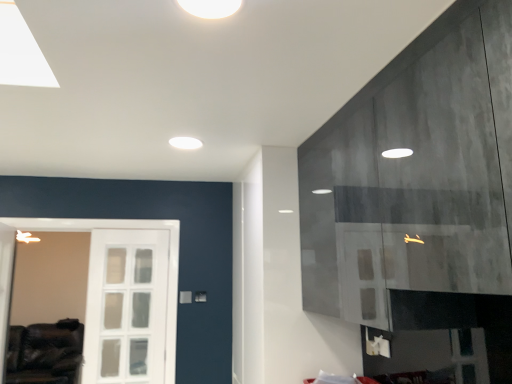
The width and height of the screenshot is (512, 384). What are the coordinates of `white matte ceiling light at upper center, which is the second lighting from top to bottom` in the screenshot? It's located at (185, 143).

The width and height of the screenshot is (512, 384). What are the coordinates of `leather couch at lower left` in the screenshot? It's located at (45, 353).

This screenshot has width=512, height=384. Find the location of `furniture below the white matte light fixture at upper center, which ranks as the second lighting in bottom-to-top order (from the image's perspective)`. furniture below the white matte light fixture at upper center, which ranks as the second lighting in bottom-to-top order (from the image's perspective) is located at coordinates (45, 353).

Considering the relative sizes of leather couch at lower left and white matte light fixture at upper center, which appears as the second lighting when viewed from the back, in the image provided, is leather couch at lower left wider than white matte light fixture at upper center, which appears as the second lighting when viewed from the back,?

Correct, the width of leather couch at lower left exceeds that of white matte light fixture at upper center, which appears as the second lighting when viewed from the back.

Which is closer, (22,357) or (229,7)?

Point (229,7)

From the image's perspective, which one is positioned higher, leather couch at lower left or white matte light fixture at upper center, which ranks as the second lighting in bottom-to-top order?

From the image's view, white matte light fixture at upper center, which ranks as the second lighting in bottom-to-top order, is above.

From a real-world perspective, between white matte ceiling light at upper center, the 2th lighting positioned from the right, and white matte light fixture at upper center, which ranks as the 1th lighting in front-to-back order, who is vertically higher?

white matte light fixture at upper center, which ranks as the 1th lighting in front-to-back order.

Where is `lighting above the white matte ceiling light at upper center, which is the second lighting from top to bottom (from the image's perspective)`? Image resolution: width=512 pixels, height=384 pixels. lighting above the white matte ceiling light at upper center, which is the second lighting from top to bottom (from the image's perspective) is located at coordinates (210, 8).

Are white matte ceiling light at upper center, which is the second lighting from top to bottom, and white matte light fixture at upper center, the 2th lighting when ordered from left to right, far apart?

white matte ceiling light at upper center, which is the second lighting from top to bottom, is positioned a significant distance from white matte light fixture at upper center, the 2th lighting when ordered from left to right.

Can you confirm if white matte ceiling light at upper center, which ranks as the 1th lighting in bottom-to-top order, is bigger than white matte light fixture at upper center, which ranks as the second lighting in bottom-to-top order?

Indeed, white matte ceiling light at upper center, which ranks as the 1th lighting in bottom-to-top order, has a larger size compared to white matte light fixture at upper center, which ranks as the second lighting in bottom-to-top order.

Does point (216, 2) appear closer or farther from the camera than point (194, 146)?

Clearly, point (216, 2) is closer to the camera than point (194, 146).

Is white matte light fixture at upper center, which ranks as the 1th lighting in front-to-back order, facing towards white matte ceiling light at upper center, placed as the 1th lighting when sorted from left to right?

No, white matte light fixture at upper center, which ranks as the 1th lighting in front-to-back order, is not aimed at white matte ceiling light at upper center, placed as the 1th lighting when sorted from left to right.

From a real-world perspective, is white matte light fixture at upper center, which appears as the second lighting when viewed from the back, above or below white matte ceiling light at upper center, the 2th lighting positioned from the right?

white matte light fixture at upper center, which appears as the second lighting when viewed from the back, is above white matte ceiling light at upper center, the 2th lighting positioned from the right.

Considering the relative sizes of white matte light fixture at upper center, acting as the first lighting starting from the top, and white matte ceiling light at upper center, the 2th lighting positioned from the right, in the image provided, is white matte light fixture at upper center, acting as the first lighting starting from the top, shorter than white matte ceiling light at upper center, the 2th lighting positioned from the right,?

No.

Considering the sizes of leather couch at lower left and white matte ceiling light at upper center, which is the second lighting from top to bottom, in the image, is leather couch at lower left wider or thinner than white matte ceiling light at upper center, which is the second lighting from top to bottom,?

leather couch at lower left is wider than white matte ceiling light at upper center, which is the second lighting from top to bottom.

From the image's perspective, which is above, leather couch at lower left or white matte ceiling light at upper center, the 1th lighting in the back-to-front sequence?

From the image's view, white matte ceiling light at upper center, the 1th lighting in the back-to-front sequence, is above.

Is leather couch at lower left touching white matte ceiling light at upper center, positioned as the 2th lighting in front-to-back order?

No, leather couch at lower left is not in contact with white matte ceiling light at upper center, positioned as the 2th lighting in front-to-back order.

What's the angular difference between leather couch at lower left and white matte ceiling light at upper center, which ranks as the 1th lighting in bottom-to-top order,'s facing directions?

The angular difference between leather couch at lower left and white matte ceiling light at upper center, which ranks as the 1th lighting in bottom-to-top order, is 89.7 degrees.

Is white matte ceiling light at upper center, the 1th lighting in the back-to-front sequence, positioned beyond the bounds of leather couch at lower left?

Yes, white matte ceiling light at upper center, the 1th lighting in the back-to-front sequence, is outside of leather couch at lower left.

Would you say white matte ceiling light at upper center, placed as the 1th lighting when sorted from left to right, is to the left or to the right of leather couch at lower left in the picture?

Based on their positions, white matte ceiling light at upper center, placed as the 1th lighting when sorted from left to right, is located to the right of leather couch at lower left.

How many degrees apart are the facing directions of white matte ceiling light at upper center, which ranks as the 1th lighting in bottom-to-top order, and leather couch at lower left?

89.7 degrees.

Measure the distance from white matte ceiling light at upper center, the 2th lighting positioned from the right, to leather couch at lower left.

white matte ceiling light at upper center, the 2th lighting positioned from the right, is 3.60 meters from leather couch at lower left.

Which object is positioned more to the right, white matte light fixture at upper center, which ranks as the 1th lighting in front-to-back order, or leather couch at lower left?

Positioned to the right is white matte light fixture at upper center, which ranks as the 1th lighting in front-to-back order.

Is white matte light fixture at upper center, the 1th lighting positioned from the right, aimed at leather couch at lower left?

A: No, white matte light fixture at upper center, the 1th lighting positioned from the right, is not aimed at leather couch at lower left.

From the image's perspective, would you say white matte light fixture at upper center, which appears as the second lighting when viewed from the back, is positioned over leather couch at lower left?

Yes, from the image's perspective, white matte light fixture at upper center, which appears as the second lighting when viewed from the back, is above leather couch at lower left.

This screenshot has height=384, width=512. What are the coordinates of `furniture lying on the left of white matte light fixture at upper center, which ranks as the second lighting in bottom-to-top order` in the screenshot? It's located at (45, 353).

The height and width of the screenshot is (384, 512). In order to click on lighting located in front of the white matte ceiling light at upper center, positioned as the 2th lighting in front-to-back order in this screenshot , I will do `click(210, 8)`.

Considering their positions, is leather couch at lower left positioned further to white matte light fixture at upper center, the 1th lighting positioned from the right, than white matte ceiling light at upper center, which ranks as the 1th lighting in bottom-to-top order?

leather couch at lower left is further to white matte light fixture at upper center, the 1th lighting positioned from the right.

Looking at the image, which one is located further to white matte ceiling light at upper center, positioned as the 2th lighting in front-to-back order, leather couch at lower left or white matte light fixture at upper center, which appears as the second lighting when viewed from the back?

The object further to white matte ceiling light at upper center, positioned as the 2th lighting in front-to-back order, is leather couch at lower left.

Looking at the image, which one is located further to leather couch at lower left, white matte light fixture at upper center, the 1th lighting positioned from the right, or white matte ceiling light at upper center, the 1th lighting in the back-to-front sequence?

white matte light fixture at upper center, the 1th lighting positioned from the right, is positioned further to the anchor leather couch at lower left.

Considering their positions, is white matte light fixture at upper center, which ranks as the second lighting in bottom-to-top order, positioned closer to white matte ceiling light at upper center, which is the second lighting from top to bottom, than leather couch at lower left?

white matte light fixture at upper center, which ranks as the second lighting in bottom-to-top order.

Considering their positions, is white matte ceiling light at upper center, the 2th lighting positioned from the right, positioned further to leather couch at lower left than white matte light fixture at upper center, which appears as the second lighting when viewed from the back?

white matte light fixture at upper center, which appears as the second lighting when viewed from the back, lies further to leather couch at lower left than the other object.

Estimate the real-world distances between objects in this image. Which object is closer to white matte light fixture at upper center, the 2th lighting when ordered from left to right, white matte ceiling light at upper center, the 1th lighting in the back-to-front sequence, or leather couch at lower left?

white matte ceiling light at upper center, the 1th lighting in the back-to-front sequence, is closer to white matte light fixture at upper center, the 2th lighting when ordered from left to right.

Identify the location of lighting located between white matte light fixture at upper center, the 1th lighting positioned from the right, and leather couch at lower left in the depth direction. (185, 143).